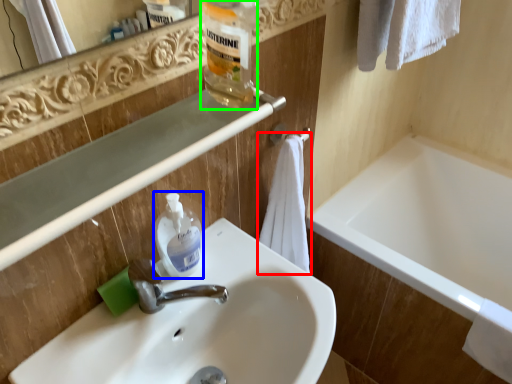
Question: Based on their relative distances, which object is nearer to bath towel (highlighted by a red box)? Choose from cleaning product (highlighted by a blue box) and bottle (highlighted by a green box).

Choices:
 (A) cleaning product
 (B) bottle

Answer: (A)